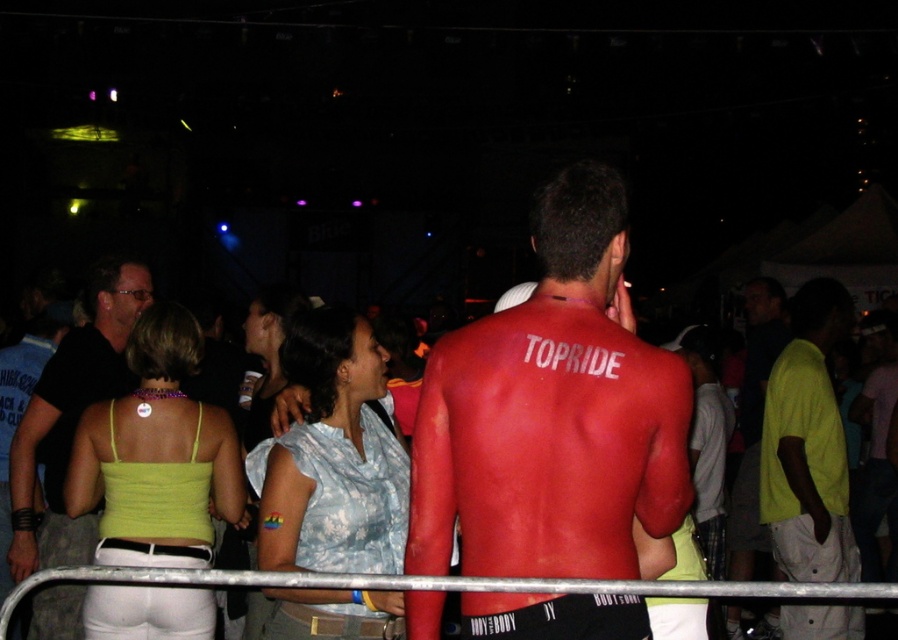
You are organizing a costume party and need to arrange two shirts, the matte yellow shirt at center and the matte black shirt at upper left, on a display rack. The rack has a maximum width of 3 meters. Will both shirts fit side by side on the rack without overlapping?

The matte yellow shirt at center and the matte black shirt at upper left are 3.40 meters apart from each other. Since the display rack is only 3 meters wide, the shirts will not fit side by side without overlapping.

You are a photographer at the event and want to capture the man in the center. The matte red body paint at center and the matte black shirt at upper left are both in your viewfinder. Which object is covering the other in the image?

The matte red body paint at center is positioned over the matte black shirt at upper left, so it is covering the shirt.

You are standing at the camera position and want to grab the matte yellow shirt at center. Can you reach it without moving your feet?

The matte yellow shirt at center is 5.01 meters away from the camera, so you cannot reach it without moving your feet since it is farther than arm length.